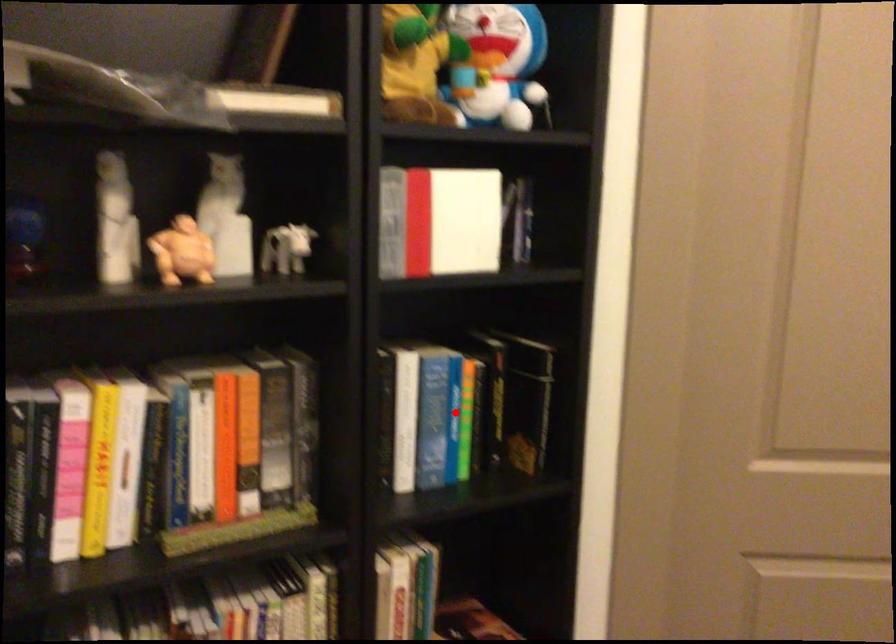
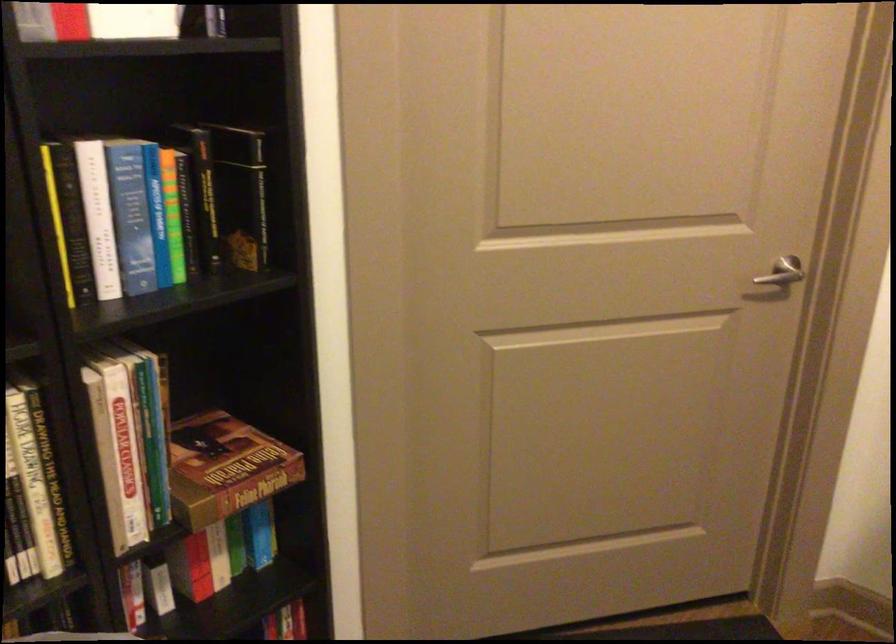
The point at the highlighted location is marked in the first image. Where is the corresponding point in the second image?

(156, 214)